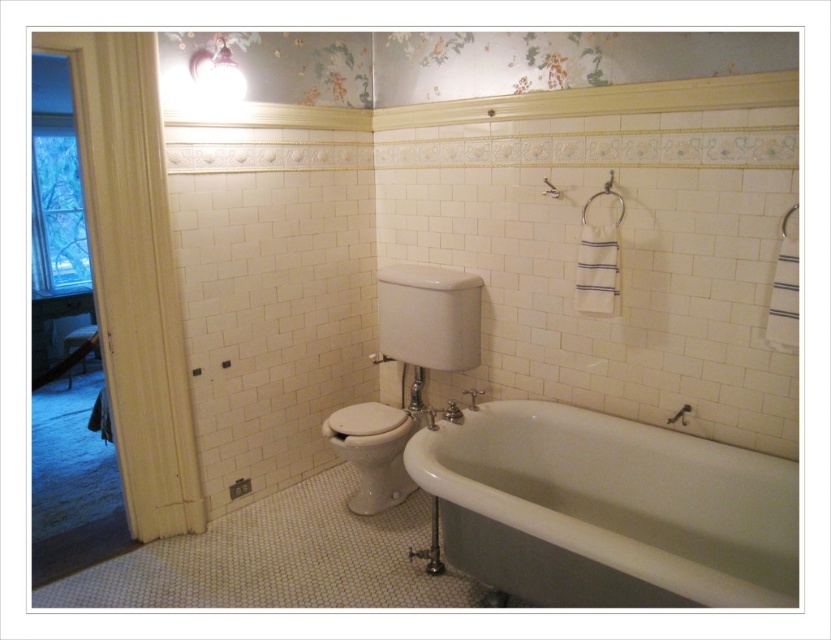
Is point (357, 444) farther from camera compared to point (547, 195)?

Yes, point (357, 444) is behind point (547, 195).

Is white glossy toilet bowl at center positioned before white ceramic shower at upper center?

No, white glossy toilet bowl at center is further to the viewer.

This screenshot has width=831, height=640. I want to click on white glossy toilet bowl at center, so click(372, 452).

Which is in front, point (327, 438) or point (682, 412)?

Point (682, 412)

This screenshot has width=831, height=640. What do you see at coordinates (372, 452) in the screenshot? I see `white glossy toilet bowl at center` at bounding box center [372, 452].

Locate an element on the screen. The image size is (831, 640). white glossy toilet bowl at center is located at coordinates (372, 452).

Is white ceramic shower at lower right above white metal towel bar at upper right?

No, white ceramic shower at lower right is not above white metal towel bar at upper right.

Between white ceramic shower at lower right and white metal towel bar at upper right, which one appears on the right side from the viewer's perspective?

From the viewer's perspective, white ceramic shower at lower right appears more on the right side.

Who is more distant from viewer, (675, 417) or (375, 356)?

The point (375, 356) is behind.

Find the location of a particular element. Image resolution: width=831 pixels, height=640 pixels. white ceramic shower at lower right is located at coordinates (680, 416).